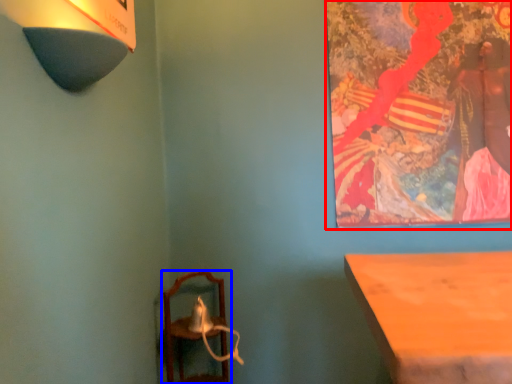
Question: Which object appears farthest to the camera in this image, picture frame (highlighted by a red box) or furniture (highlighted by a blue box)?

Choices:
 (A) picture frame
 (B) furniture

Answer: (A)